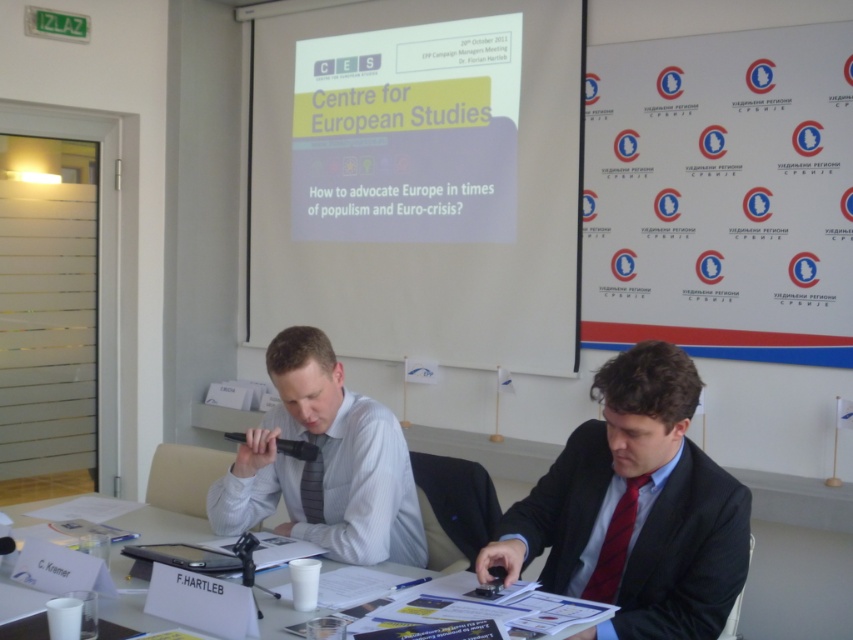
Question: Can you confirm if red satin tie at lower right is smaller than black fabric tie at center?

Choices:
 (A) no
 (B) yes

Answer: (A)

Question: In this image, where is white matte projector screen at upper center located relative to black fabric tie at center?

Choices:
 (A) above
 (B) below

Answer: (A)

Question: Is dark blue suit at center wider than red satin tie at lower right?

Choices:
 (A) no
 (B) yes

Answer: (B)

Question: Which object is farther from the camera taking this photo?

Choices:
 (A) dark blue suit at center
 (B) black fabric tie at center

Answer: (B)

Question: Which object appears farthest from the camera in this image?

Choices:
 (A) black fabric tie at center
 (B) white matte projector screen at upper center
 (C) dark blue suit at center
 (D) red satin tie at lower right

Answer: (B)

Question: Which point appears farthest from the camera in this image?

Choices:
 (A) (230, 477)
 (B) (544, 264)

Answer: (B)